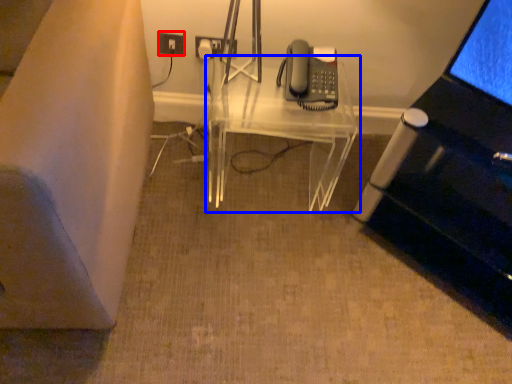
Question: Which point is closer to the camera, electric outlet (highlighted by a red box) or table (highlighted by a blue box)?

Choices:
 (A) electric outlet
 (B) table

Answer: (B)